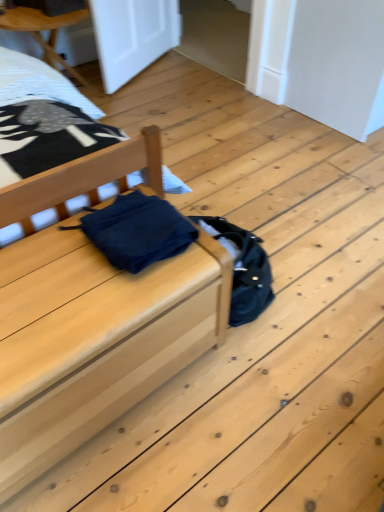
The image size is (384, 512). What are the coordinates of `free spot in front of dark blue fabric at center` in the screenshot? It's located at (93, 302).